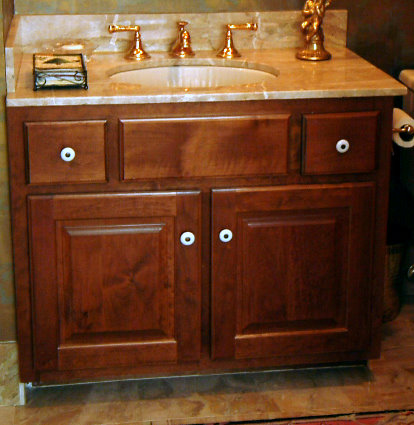
Locate an element on the screen. This screenshot has width=414, height=425. left cabinet door handle is located at coordinates (186, 237).